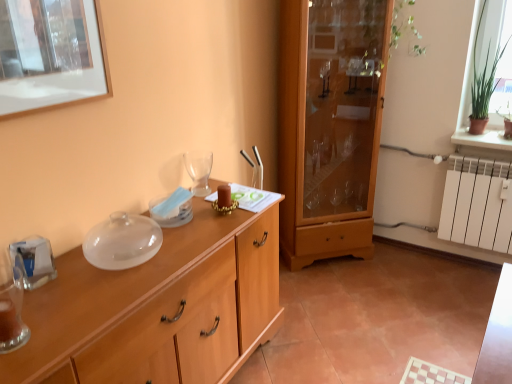
Question: Is wooden cabinet at center at the right side of transparent glass wine glass at center?

Choices:
 (A) no
 (B) yes

Answer: (A)

Question: Is wooden cabinet at center facing towards transparent glass wine glass at center?

Choices:
 (A) no
 (B) yes

Answer: (A)

Question: From the image's perspective, is wooden cabinet at center over transparent glass wine glass at center?

Choices:
 (A) no
 (B) yes

Answer: (A)

Question: Can you confirm if wooden cabinet at center is shorter than transparent glass wine glass at center?

Choices:
 (A) yes
 (B) no

Answer: (B)

Question: Does wooden cabinet at center appear on the left side of transparent glass wine glass at center?

Choices:
 (A) no
 (B) yes

Answer: (B)

Question: Does wooden cabinet at center have a larger size compared to transparent glass wine glass at center?

Choices:
 (A) yes
 (B) no

Answer: (A)

Question: Is transparent glass wine glass at center outside of translucent glass vase at left?

Choices:
 (A) yes
 (B) no

Answer: (A)

Question: Considering the relative positions of transparent glass wine glass at center and translucent glass vase at left in the image provided, is transparent glass wine glass at center to the right of translucent glass vase at left from the viewer's perspective?

Choices:
 (A) yes
 (B) no

Answer: (A)

Question: Is transparent glass wine glass at center behind translucent glass vase at left?

Choices:
 (A) no
 (B) yes

Answer: (B)

Question: Are transparent glass wine glass at center and translucent glass vase at left making contact?

Choices:
 (A) yes
 (B) no

Answer: (B)

Question: Is transparent glass wine glass at center to the left of translucent glass vase at left from the viewer's perspective?

Choices:
 (A) yes
 (B) no

Answer: (B)

Question: From the image's perspective, is transparent glass wine glass at center over translucent glass vase at left?

Choices:
 (A) yes
 (B) no

Answer: (A)

Question: From the image's perspective, is wooden cabinet at center beneath transparent glass wine glass at center?

Choices:
 (A) no
 (B) yes

Answer: (A)